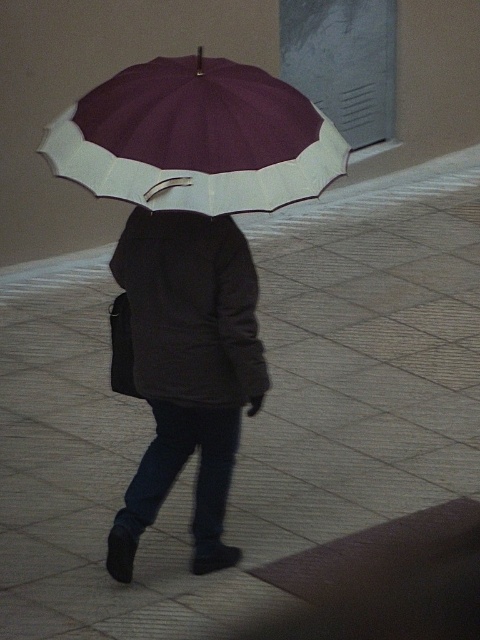
From the picture: Does dark gray fabric jacket at center appear on the right side of maroon fabric umbrella at upper center?

In fact, dark gray fabric jacket at center is to the left of maroon fabric umbrella at upper center.

Is dark gray fabric jacket at center further to camera compared to maroon fabric umbrella at upper center?

Yes.

Is point (175, 410) less distant than point (135, 164)?

No, (175, 410) is behind (135, 164).

Identify the location of dark gray fabric jacket at center. The image size is (480, 640). (188, 369).